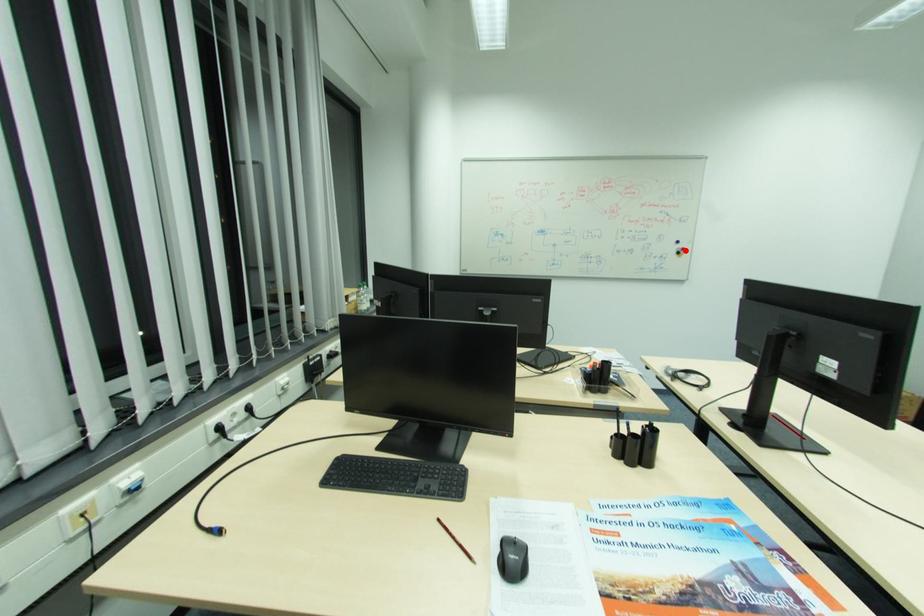
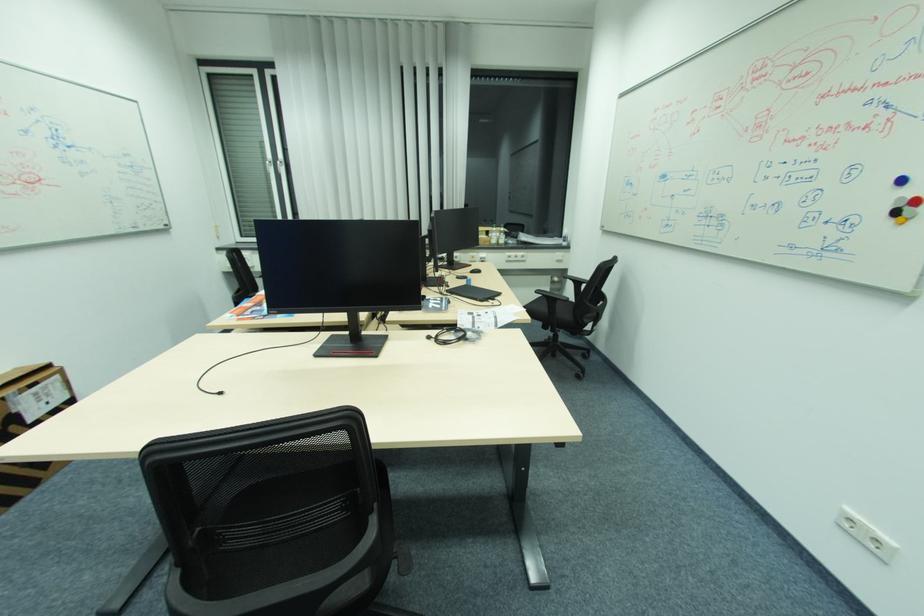
Where in the second image is the point corresponding to the highlighted location from the first image?

(907, 206)